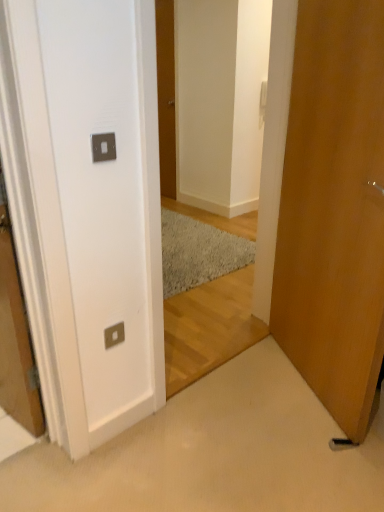
Question: In which direction should I rotate to look at wooden door at center, placed as the first door when sorted from back to front?

Choices:
 (A) left
 (B) right

Answer: (A)

Question: Is wooden door at right, acting as the second door starting from the top, at the back of wooden door at center, marked as the second door in a bottom-to-top arrangement?

Choices:
 (A) no
 (B) yes

Answer: (A)

Question: Does wooden door at center, which ranks as the first door in top-to-bottom order, have a smaller size compared to wooden door at right, which is counted as the 1th door, starting from the bottom?

Choices:
 (A) yes
 (B) no

Answer: (A)

Question: Is wooden door at center, marked as the second door in a bottom-to-top arrangement, positioned beyond the bounds of wooden door at right, acting as the second door starting from the back?

Choices:
 (A) yes
 (B) no

Answer: (A)

Question: Is wooden door at center, placed as the first door when sorted from back to front, thinner than wooden door at right, acting as the second door starting from the back?

Choices:
 (A) no
 (B) yes

Answer: (B)

Question: Considering the relative positions of wooden door at center, placed as the second door when sorted from front to back, and wooden door at right, arranged as the first door when viewed from the right, in the image provided, is wooden door at center, placed as the second door when sorted from front to back, in front of wooden door at right, arranged as the first door when viewed from the right,?

Choices:
 (A) yes
 (B) no

Answer: (B)

Question: Can you confirm if wooden door at center, marked as the second door in a bottom-to-top arrangement, is positioned to the left of wooden door at right, arranged as the first door when viewed from the right?

Choices:
 (A) no
 (B) yes

Answer: (B)

Question: Considering the relative sizes of wooden door at right, which is counted as the 1th door, starting from the bottom, and satin silver switchplate at lower left in the image provided, is wooden door at right, which is counted as the 1th door, starting from the bottom, shorter than satin silver switchplate at lower left?

Choices:
 (A) yes
 (B) no

Answer: (B)

Question: Does wooden door at right, acting as the second door starting from the back, come in front of satin silver switchplate at lower left?

Choices:
 (A) yes
 (B) no

Answer: (A)

Question: From the image's perspective, would you say wooden door at right, acting as the second door starting from the back, is shown under satin silver switchplate at lower left?

Choices:
 (A) no
 (B) yes

Answer: (A)

Question: Is wooden door at right, which is the 2th door from left to right, not close to satin silver switchplate at lower left?

Choices:
 (A) no
 (B) yes

Answer: (B)

Question: Can you confirm if wooden door at right, the 1th door positioned from the front, is thinner than satin silver switchplate at lower left?

Choices:
 (A) no
 (B) yes

Answer: (A)

Question: Would you say wooden door at right, acting as the second door starting from the back, is outside satin silver switchplate at lower left?

Choices:
 (A) no
 (B) yes

Answer: (B)

Question: Can you confirm if wooden door at right, arranged as the first door when viewed from the right, is positioned to the left of wooden door at center, marked as the 1th door in a left-to-right arrangement?

Choices:
 (A) yes
 (B) no

Answer: (B)